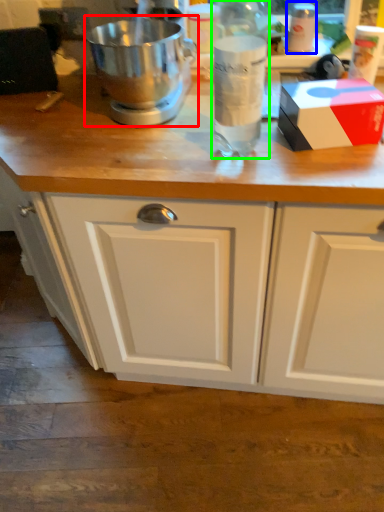
Question: Which object is the farthest from mixer (highlighted by a red box)? Choose among these: bottle (highlighted by a blue box) or bottle (highlighted by a green box).

Choices:
 (A) bottle
 (B) bottle

Answer: (A)